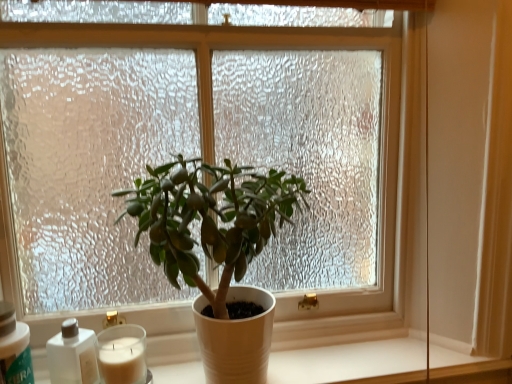
Question: Considering the relative sizes of white matte bottle at lower left, which appears as the 2th bottle when viewed from the left, and matte white pot at center in the image provided, is white matte bottle at lower left, which appears as the 2th bottle when viewed from the left, wider than matte white pot at center?

Choices:
 (A) yes
 (B) no

Answer: (B)

Question: From the image's perspective, would you say white matte bottle at lower left, which appears as the 2th bottle when viewed from the left, is shown under matte white pot at center?

Choices:
 (A) no
 (B) yes

Answer: (B)

Question: Are white matte bottle at lower left, which appears as the 2th bottle when viewed from the left, and matte white pot at center located far from each other?

Choices:
 (A) no
 (B) yes

Answer: (A)

Question: From a real-world perspective, does white matte bottle at lower left, which appears as the 2th bottle when viewed from the left, sit lower than matte white pot at center?

Choices:
 (A) no
 (B) yes

Answer: (B)

Question: Is white matte bottle at lower left, positioned as the first bottle in right-to-left order, looking in the opposite direction of matte white pot at center?

Choices:
 (A) no
 (B) yes

Answer: (A)

Question: Is white wax candle at lower left wider or thinner than white matte pot at center?

Choices:
 (A) thin
 (B) wide

Answer: (A)

Question: From the image's perspective, is white wax candle at lower left positioned above or below white matte pot at center?

Choices:
 (A) above
 (B) below

Answer: (A)

Question: Considering the positions of point (138, 354) and point (386, 334), is point (138, 354) closer or farther from the camera than point (386, 334)?

Choices:
 (A) closer
 (B) farther

Answer: (A)

Question: Do you think white wax candle at lower left is within white matte pot at center, or outside of it?

Choices:
 (A) inside
 (B) outside

Answer: (B)

Question: Based on their sizes in the image, would you say white plastic bottle at lower left, which ranks as the first bottle in left-to-right order, is bigger or smaller than white wax candle at lower left?

Choices:
 (A) small
 (B) big

Answer: (B)

Question: Is white plastic bottle at lower left, which ranks as the first bottle in left-to-right order, to the left or to the right of white wax candle at lower left in the image?

Choices:
 (A) left
 (B) right

Answer: (A)

Question: Is white plastic bottle at lower left, which ranks as the first bottle in left-to-right order, situated inside white wax candle at lower left or outside?

Choices:
 (A) outside
 (B) inside

Answer: (A)

Question: In terms of width, does white plastic bottle at lower left, which appears as the 2th bottle when viewed from the right, look wider or thinner when compared to white wax candle at lower left?

Choices:
 (A) wide
 (B) thin

Answer: (A)

Question: Is white plastic bottle at lower left, which ranks as the first bottle in left-to-right order, spatially inside white matte bottle at lower left, which appears as the 2th bottle when viewed from the left, or outside of it?

Choices:
 (A) inside
 (B) outside

Answer: (B)

Question: Visually, is white plastic bottle at lower left, which appears as the 2th bottle when viewed from the right, positioned to the left or to the right of white matte bottle at lower left, which appears as the 2th bottle when viewed from the left?

Choices:
 (A) right
 (B) left

Answer: (B)